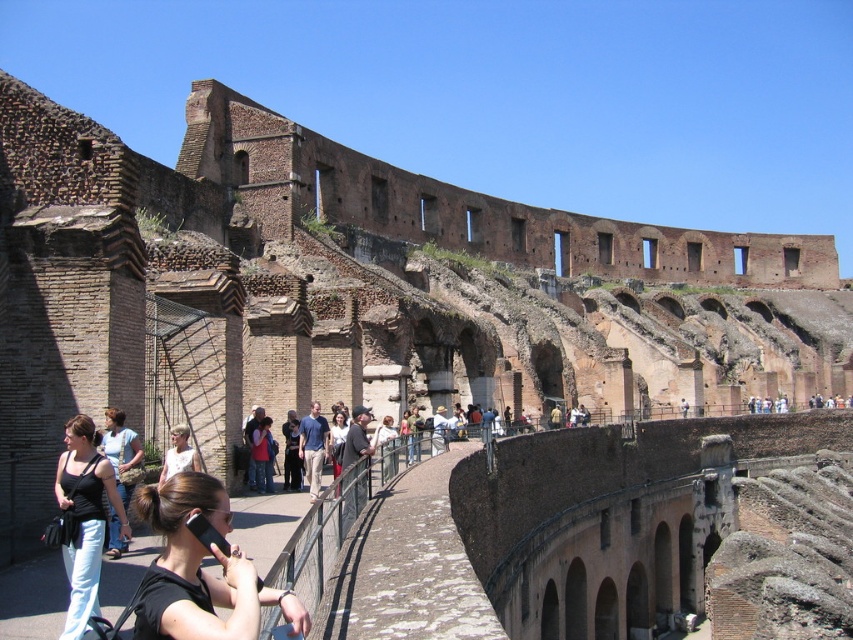
You are a photographer at the Colosseum and want to capture a photo of both the black matte phone at center and the light brown leather jacket at lower left. Which object should you focus on first if you want to ensure both are in the frame without moving the camera?

You should focus on the light brown leather jacket at lower left first because the black matte phone at center is taller than it, so adjusting focus to the closer object first will help ensure both are in the frame.

You are standing at the Colosseum and want to take a photo of the point at coordinates (270,444). The camera you are using has a maximum focus range of 60 meters. Will the camera be able to focus on the point?

The point at coordinates (270,444) is 62.51 meters away from the camera. Since the camera can only focus up to 60 meters, it will not be able to focus on the point.